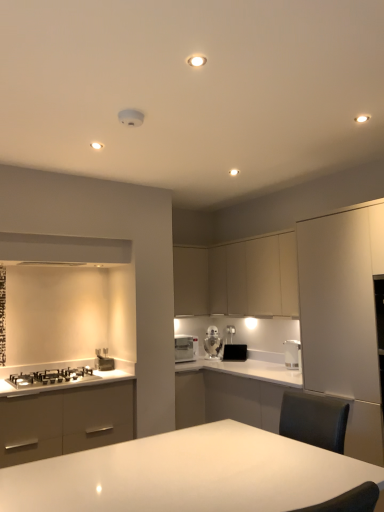
Question: Which direction should I rotate to face black matte toaster at center, positioned as the first appliance in right-to-left order, — up or down?

Choices:
 (A) down
 (B) up

Answer: (A)

Question: Does white glossy toaster at center, marked as the first kitchen appliance in a back-to-front arrangement, appear on the left side of white glossy microwave at center, the 2th kitchen appliance positioned from the front?

Choices:
 (A) no
 (B) yes

Answer: (A)

Question: Is white glossy toaster at center, marked as the first kitchen appliance in a back-to-front arrangement, shorter than white glossy microwave at center, which ranks as the 3th kitchen appliance in right-to-left order?

Choices:
 (A) no
 (B) yes

Answer: (A)

Question: Is white glossy toaster at center, which is the third kitchen appliance in front-to-back order, located outside white glossy microwave at center, which ranks as the 3th kitchen appliance in right-to-left order?

Choices:
 (A) no
 (B) yes

Answer: (B)

Question: Does white glossy toaster at center, which is the second kitchen appliance from left to right, turn towards white glossy microwave at center, which is the second kitchen appliance from back to front?

Choices:
 (A) no
 (B) yes

Answer: (A)

Question: Can white glossy microwave at center, the 2th kitchen appliance positioned from the front, be found inside white glossy toaster at center, which is the third kitchen appliance in front-to-back order?

Choices:
 (A) no
 (B) yes

Answer: (A)

Question: Is white glossy toaster at center, arranged as the second kitchen appliance when viewed from the right, to the right of white glossy microwave at center, which is the second kitchen appliance from back to front, from the viewer's perspective?

Choices:
 (A) no
 (B) yes

Answer: (B)

Question: Is white glossy table at center to the left of white matte cabinet at right, the first cabinetry from the front, from the viewer's perspective?

Choices:
 (A) yes
 (B) no

Answer: (A)

Question: Does white glossy table at center have a greater height compared to white matte cabinet at right, the first cabinetry from the front?

Choices:
 (A) yes
 (B) no

Answer: (B)

Question: Could you tell me if white glossy table at center is turned towards white matte cabinet at right, which is counted as the 3th cabinetry, starting from the back?

Choices:
 (A) no
 (B) yes

Answer: (B)

Question: Is white glossy table at center shorter than white matte cabinet at right, which is counted as the 3th cabinetry, starting from the back?

Choices:
 (A) yes
 (B) no

Answer: (A)

Question: Is white glossy table at center surrounding white matte cabinet at right, the first cabinetry from the front?

Choices:
 (A) no
 (B) yes

Answer: (A)

Question: Does white glossy table at center appear on the right side of white matte cabinet at right, which is counted as the 3th cabinetry, starting from the back?

Choices:
 (A) no
 (B) yes

Answer: (A)

Question: Does white glossy countertop at lower left lie behind matte beige cabinet at center, placed as the 1th cabinetry when sorted from back to front?

Choices:
 (A) no
 (B) yes

Answer: (A)